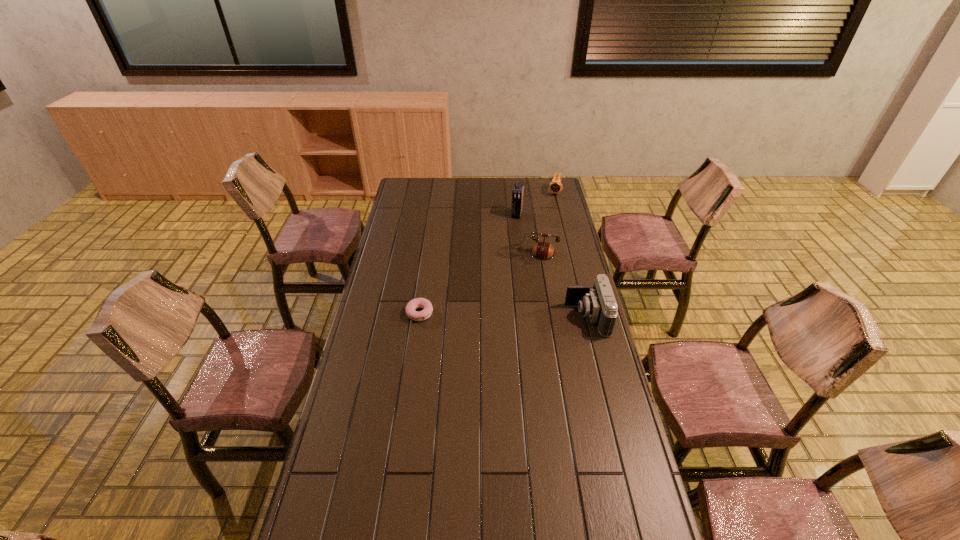
This screenshot has height=540, width=960. Identify the location of free space on the desktop that is between the leftmost object and the camera and is positioned on the face of the watch. (517, 315).

I want to click on vacant space on the desktop that is between the leftmost object and the camera and is positioned on the rotary dial of the telephone, so click(x=511, y=315).

What are the coordinates of `vacant space on the desktop that is between the doughnut and the fourth shortest object and is positioned with the zip open on the tallest object` in the screenshot? It's located at (479, 315).